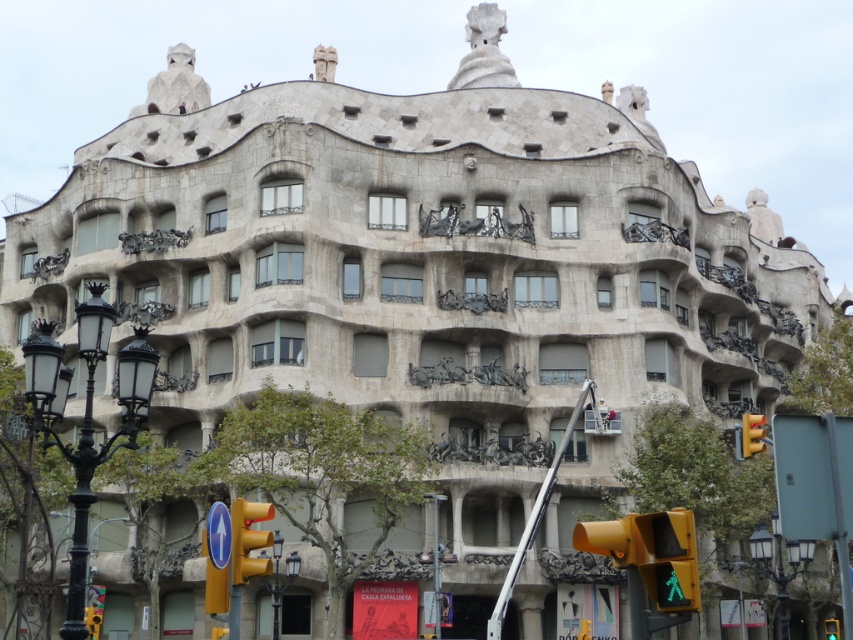
Does yellow matte pedestrian signal at lower right have a lesser width compared to yellow matte traffic light at lower right?

Yes.

Between yellow matte pedestrian signal at lower right and yellow matte traffic light at lower right, which one appears on the left side from the viewer's perspective?

From the viewer's perspective, yellow matte pedestrian signal at lower right appears more on the left side.

Where is `yellow matte pedestrian signal at lower right`? yellow matte pedestrian signal at lower right is located at coordinates (670, 560).

Identify the location of yellow matte pedestrian signal at lower right. This screenshot has height=640, width=853. (670, 560).

Does yellow matte traffic light at lower left appear on the left side of yellow plastic traffic light at lower left?

Incorrect, yellow matte traffic light at lower left is not on the left side of yellow plastic traffic light at lower left.

Measure the distance between point (242, 554) and camera.

Point (242, 554) and camera are 45.15 meters apart from each other.

Is point (242, 580) in front of point (97, 632)?

Yes, point (242, 580) is closer to viewer.

Where is `yellow matte traffic light at lower left`? This screenshot has height=640, width=853. yellow matte traffic light at lower left is located at coordinates (248, 540).

Is point (749, 440) farther from viewer compared to point (88, 614)?

No, it is in front of (88, 614).

Who is shorter, yellow matte traffic light at lower right or yellow plastic traffic light at lower left?

Standing shorter between the two is yellow matte traffic light at lower right.

Between point (761, 432) and point (91, 624), which one is positioned behind?

The point (91, 624) is behind.

The image size is (853, 640). What are the coordinates of `yellow matte traffic light at lower right` in the screenshot? It's located at (752, 435).